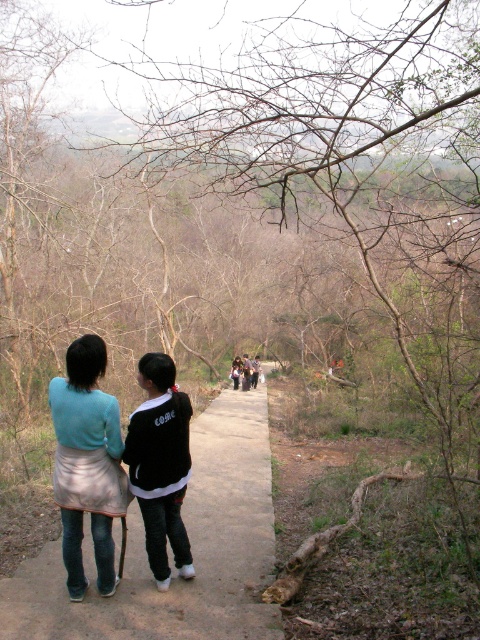
Question: Which of the following is the farthest from the observer?

Choices:
 (A) black cotton jacket at center
 (B) brown concrete path at center

Answer: (A)

Question: Which of the following is the closest to the observer?

Choices:
 (A) (41, 548)
 (B) (179, 412)

Answer: (B)

Question: Is brown concrete path at center smaller than black cotton jacket at center?

Choices:
 (A) yes
 (B) no

Answer: (B)

Question: Among these points, which one is farthest from the camera?

Choices:
 (A) (133, 412)
 (B) (80, 364)

Answer: (A)

Question: Observing the image, what is the correct spatial positioning of light blue fabric skirt at center in reference to black cotton jacket at center?

Choices:
 (A) left
 (B) right

Answer: (A)

Question: Observing the image, what is the correct spatial positioning of brown concrete path at center in reference to light blue fabric skirt at center?

Choices:
 (A) above
 (B) below

Answer: (B)